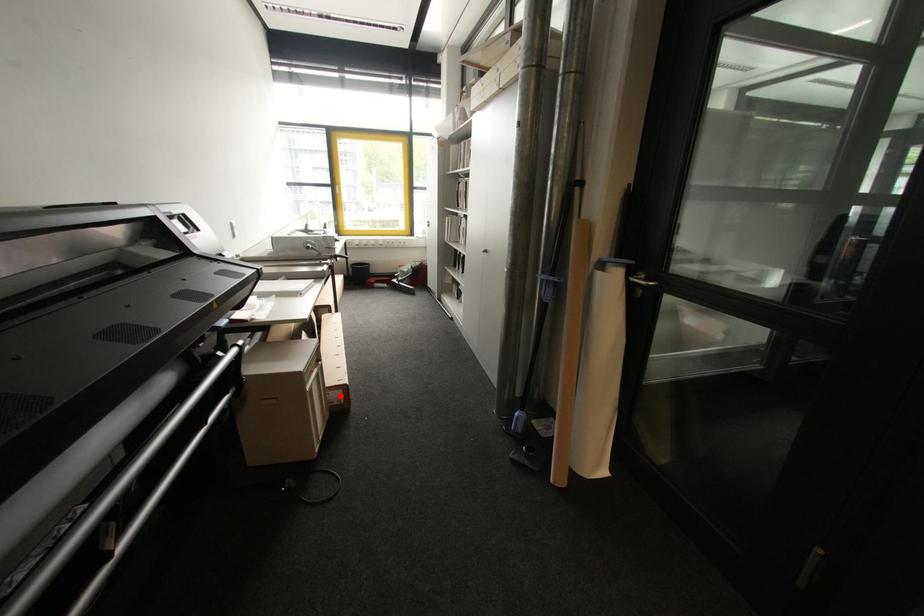
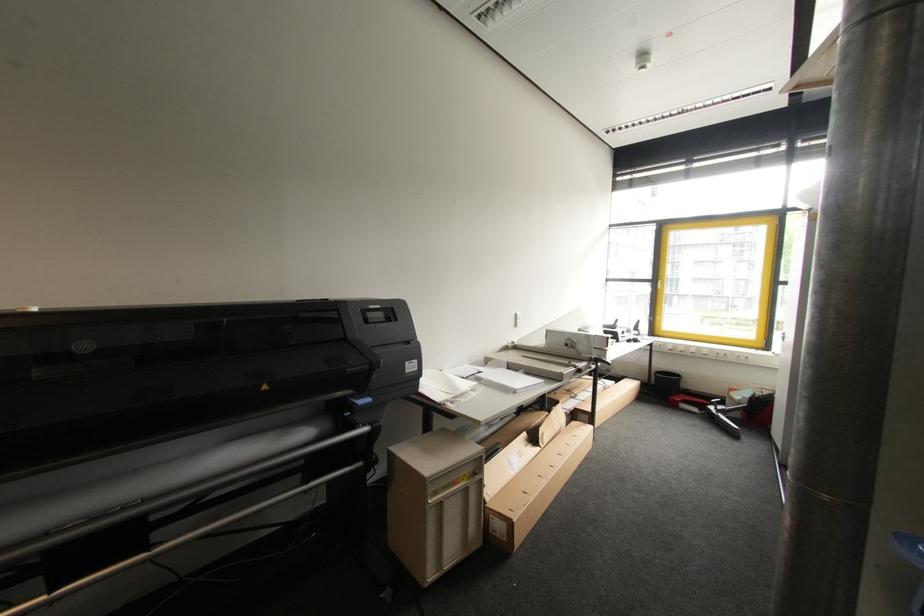
Question: A red point is marked in image1. In image2, is the corresponding 3D point closer to the camera or farther? Reply with the corresponding letter.

Choices:
 (A) The corresponding 3D point is closer.
 (B) The corresponding 3D point is farther.

Answer: (B)